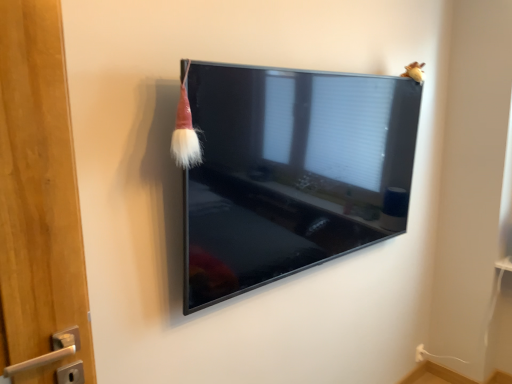
Question: Considering the relative sizes of matte black tv at center and fuzzy yellow toy at upper right in the image provided, is matte black tv at center thinner than fuzzy yellow toy at upper right?

Choices:
 (A) yes
 (B) no

Answer: (B)

Question: From a real-world perspective, is matte black tv at center positioned over fuzzy yellow toy at upper right based on gravity?

Choices:
 (A) no
 (B) yes

Answer: (A)

Question: Does matte black tv at center lie behind fuzzy yellow toy at upper right?

Choices:
 (A) no
 (B) yes

Answer: (A)

Question: Is matte black tv at center turned away from fuzzy yellow toy at upper right?

Choices:
 (A) no
 (B) yes

Answer: (A)

Question: Does matte black tv at center have a lesser height compared to fuzzy yellow toy at upper right?

Choices:
 (A) yes
 (B) no

Answer: (B)

Question: In terms of height, does red velvet brush at upper left look taller or shorter compared to matte black tv at center?

Choices:
 (A) tall
 (B) short

Answer: (B)

Question: Looking at their shapes, would you say red velvet brush at upper left is wider or thinner than matte black tv at center?

Choices:
 (A) wide
 (B) thin

Answer: (B)

Question: In terms of size, does red velvet brush at upper left appear bigger or smaller than matte black tv at center?

Choices:
 (A) big
 (B) small

Answer: (B)

Question: Visually, is red velvet brush at upper left positioned to the left or to the right of matte black tv at center?

Choices:
 (A) left
 (B) right

Answer: (A)

Question: From their relative heights in the image, would you say matte black tv at center is taller or shorter than red velvet brush at upper left?

Choices:
 (A) tall
 (B) short

Answer: (A)

Question: Would you say matte black tv at center is inside or outside red velvet brush at upper left?

Choices:
 (A) inside
 (B) outside

Answer: (B)

Question: Does point (249, 165) appear closer or farther from the camera than point (180, 107)?

Choices:
 (A) farther
 (B) closer

Answer: (A)

Question: Would you say matte black tv at center is to the left or to the right of red velvet brush at upper left in the picture?

Choices:
 (A) right
 (B) left

Answer: (A)

Question: From their relative heights in the image, would you say red velvet brush at upper left is taller or shorter than fuzzy yellow toy at upper right?

Choices:
 (A) short
 (B) tall

Answer: (B)

Question: Visually, is red velvet brush at upper left positioned to the left or to the right of fuzzy yellow toy at upper right?

Choices:
 (A) right
 (B) left

Answer: (B)